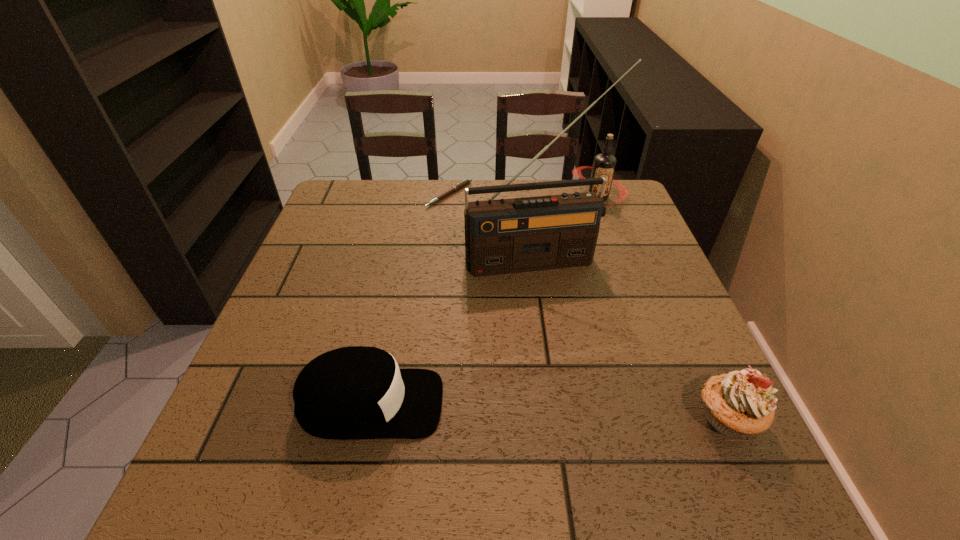
Locate an element on the screen. The width and height of the screenshot is (960, 540). free space at the left edge of the desktop is located at coordinates point(310,249).

In the image, there is a desktop. Where is `vacant space at the right edge`? The height and width of the screenshot is (540, 960). vacant space at the right edge is located at coordinates (620, 270).

The width and height of the screenshot is (960, 540). What are the coordinates of `free space at the far left corner` in the screenshot? It's located at (385, 184).

In the image, there is a desktop. What are the coordinates of `vacant space at the near left corner` in the screenshot? It's located at (265, 412).

In the image, there is a desktop. At what (x,y) coordinates should I click in order to perform the action: click on vacant space at the far right corner. Please return your answer as a coordinate pair (x, y). Looking at the image, I should click on (612, 216).

This screenshot has width=960, height=540. What are the coordinates of `free space between the third tallest object and the third nearest object` in the screenshot? It's located at (632, 339).

Where is `free space between the cupcake and the tallest object`? free space between the cupcake and the tallest object is located at coordinates (632, 339).

At what (x,y) coordinates should I click in order to perform the action: click on free space between the radio receiver and the cupcake. Please return your answer as a coordinate pair (x, y). The height and width of the screenshot is (540, 960). Looking at the image, I should click on (632, 339).

Locate an element on the screen. Image resolution: width=960 pixels, height=540 pixels. free space that is in between the pen and the second tallest object is located at coordinates (523, 196).

This screenshot has height=540, width=960. Find the location of `free spot between the root beer and the cap`. free spot between the root beer and the cap is located at coordinates (484, 301).